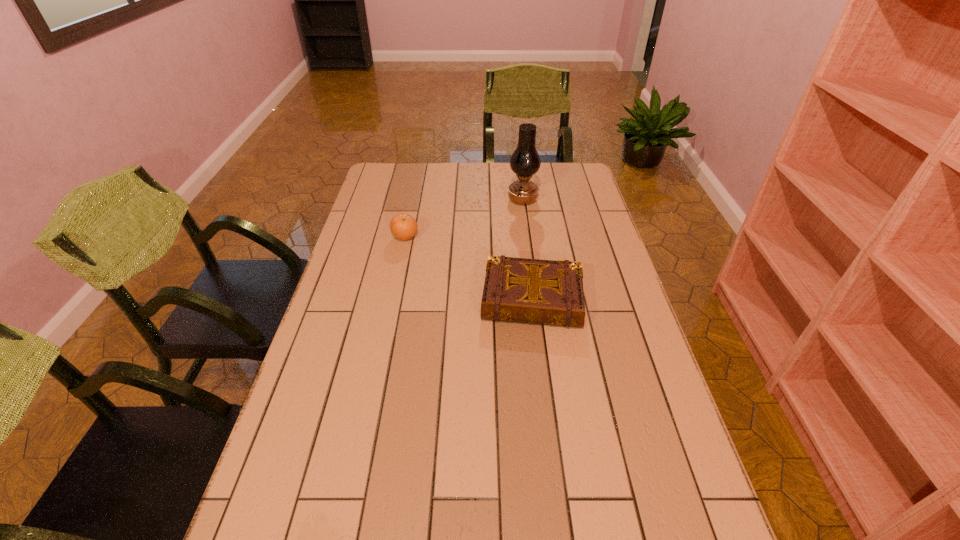
You are a GUI agent. You are given a task and a screenshot of the screen. Output one action in this format:
    pyautogui.click(x=<x>, y=<y>)
    Task: Click on the tallest object
    
    Given the screenshot: What is the action you would take?
    pyautogui.click(x=525, y=162)

This screenshot has width=960, height=540. Find the location of `the farthest object`. the farthest object is located at coordinates (525, 162).

You are a GUI agent. You are given a task and a screenshot of the screen. Output one action in this format:
    pyautogui.click(x=<x>, y=<y>)
    Task: Click on the leftmost object
    Image resolution: width=960 pixels, height=540 pixels.
    Given the screenshot: What is the action you would take?
    pyautogui.click(x=403, y=226)

You are a GUI agent. You are given a task and a screenshot of the screen. Output one action in this format:
    pyautogui.click(x=<x>, y=<y>)
    Task: Click on the orange
    Image resolution: width=960 pixels, height=540 pixels.
    Given the screenshot: What is the action you would take?
    click(403, 226)

You are a GUI agent. You are given a task and a screenshot of the screen. Output one action in this format:
    pyautogui.click(x=<x>, y=<y>)
    Task: Click on the hardback book
    Image resolution: width=960 pixels, height=540 pixels.
    Given the screenshot: What is the action you would take?
    [548, 292]

Find the location of a particular element. The width and height of the screenshot is (960, 540). the nearest object is located at coordinates (548, 292).

This screenshot has width=960, height=540. Identify the location of vacant space situated 0.360m on the front of the tallest object. (532, 269).

Where is `free space located on the back of the second tallest object`? free space located on the back of the second tallest object is located at coordinates (411, 208).

Identify the location of vacant space located on the left of the hardback book. (361, 299).

Where is `object that is at the left edge`? object that is at the left edge is located at coordinates (403, 226).